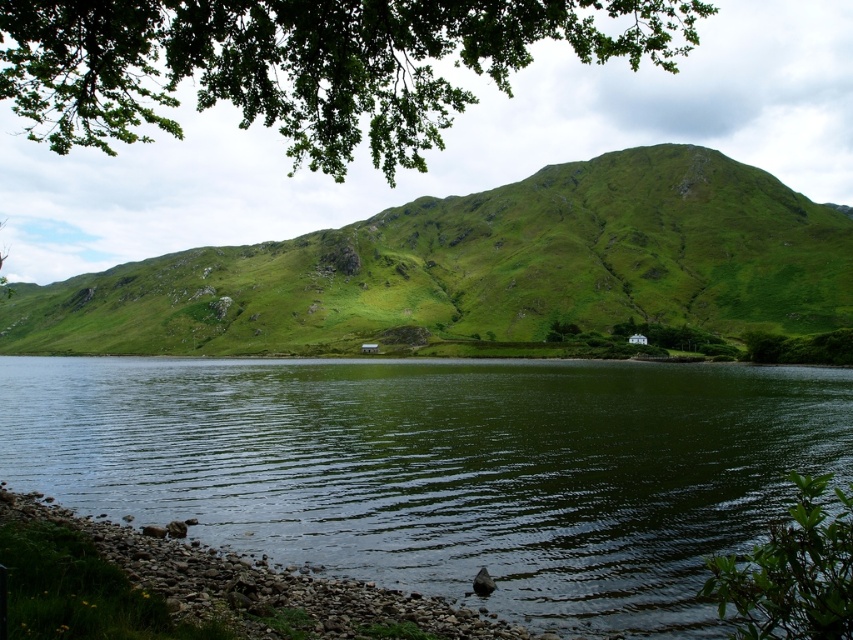
Does green reflective water at center have a larger size compared to green grassy hill at upper center?

Incorrect, green reflective water at center is not larger than green grassy hill at upper center.

Does green reflective water at center come in front of green grassy hill at upper center?

That is True.

Locate an element on the screen. green reflective water at center is located at coordinates (444, 467).

Image resolution: width=853 pixels, height=640 pixels. I want to click on green reflective water at center, so click(444, 467).

Does green reflective water at center have a smaller size compared to green leafy tree at upper center?

Indeed, green reflective water at center has a smaller size compared to green leafy tree at upper center.

Is point (238, 410) farther from viewer compared to point (199, 45)?

Yes, it is behind point (199, 45).

I want to click on green reflective water at center, so click(444, 467).

Is green grassy hill at upper center below smooth pebbles at lower left?

No, green grassy hill at upper center is not below smooth pebbles at lower left.

What do you see at coordinates (480, 268) in the screenshot?
I see `green grassy hill at upper center` at bounding box center [480, 268].

Find the location of a particular element. green grassy hill at upper center is located at coordinates (480, 268).